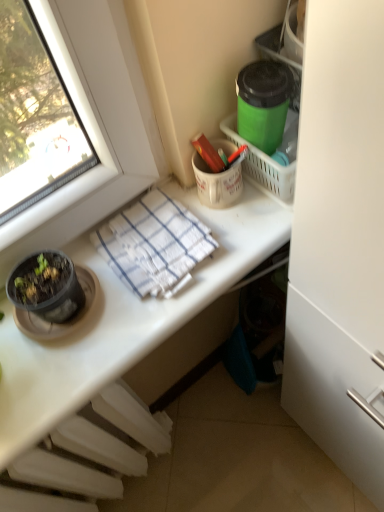
Locate an element on the screen. This screenshot has height=512, width=384. free space above white glossy desk at upper center (from a real-world perspective) is located at coordinates (136, 280).